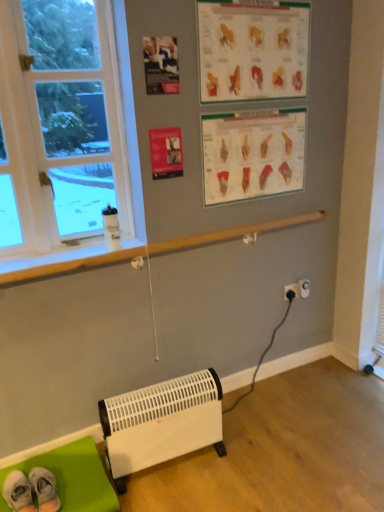
Question: Looking at the image, does white plastic heater at lower center seem bigger or smaller compared to matte plastic poster at upper center, which is counted as the second writing, starting from the top?

Choices:
 (A) big
 (B) small

Answer: (A)

Question: Do you think white plastic heater at lower center is within matte plastic poster at upper center, which is counted as the second writing, starting from the top, or outside of it?

Choices:
 (A) inside
 (B) outside

Answer: (B)

Question: Estimate the real-world distances between objects in this image. Which object is closer to the black plastic electric outlet at lower right, the second electric outlet viewed from the right?

Choices:
 (A) white plastic electric outlet at lower right, which ranks as the 1th electric outlet in right-to-left order
 (B) green fabric mat at lower left
 (C) matte plastic poster at upper center, which is counted as the 1th writing, starting from the bottom
 (D) white fabric socks at lower left
 (E) white plastic window at left

Answer: (A)

Question: Considering the real-world distances, which object is farthest from the green fabric mat at lower left?

Choices:
 (A) matte plastic poster at upper center, which is counted as the second writing, starting from the top
 (B) matte paper poster at upper center
 (C) white fabric socks at lower left
 (D) white plastic heater at lower center
 (E) white plastic window at left

Answer: (B)